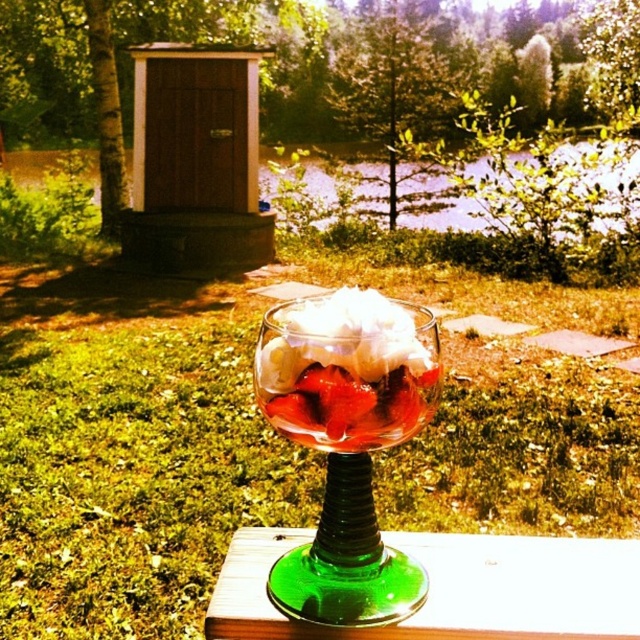
You are a bartender preparing a drink and need to choose between the green glass wine glass at center and the clear glass bowl at center. Which one has a bigger capacity?

The green glass wine glass at center is larger in size than clear glass bowl at center, so it has a bigger capacity.

You are holding a camera and want to take a photo of the dessert in the glass bowl. The camera is currently positioned at point A, which is 12.57 inches away from the point marked at coordinates point[307,333]. If you move the camera closer to the point by 3 inches, will the dessert appear larger in the photo?

Moving the camera closer to the point by 3 inches will reduce the distance from 12.57 inches to 9.57 inches. Since decreasing the distance between the camera and the subject generally makes the subject appear larger in the photo, the dessert will appear larger in the photo after moving the camera closer.

Consider the image. You are at a picnic and want to grab the green glass wine glass at center. You see a point marked at (348, 442). Is this point on the green glass wine glass at center?

Yes, the point at (348, 442) marks the green glass wine glass at center, so it is on the glass.